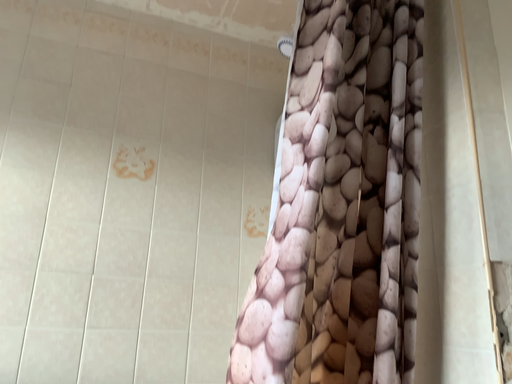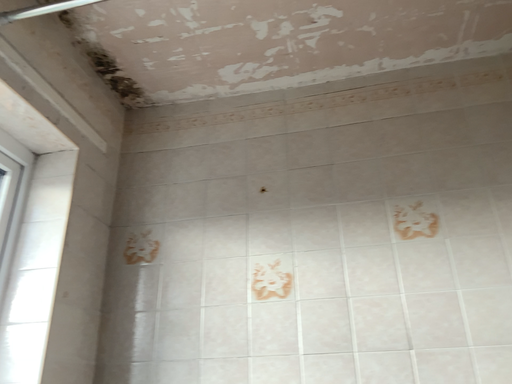
Question: How did the camera likely rotate when shooting the video?

Choices:
 (A) rotated left
 (B) rotated right

Answer: (A)